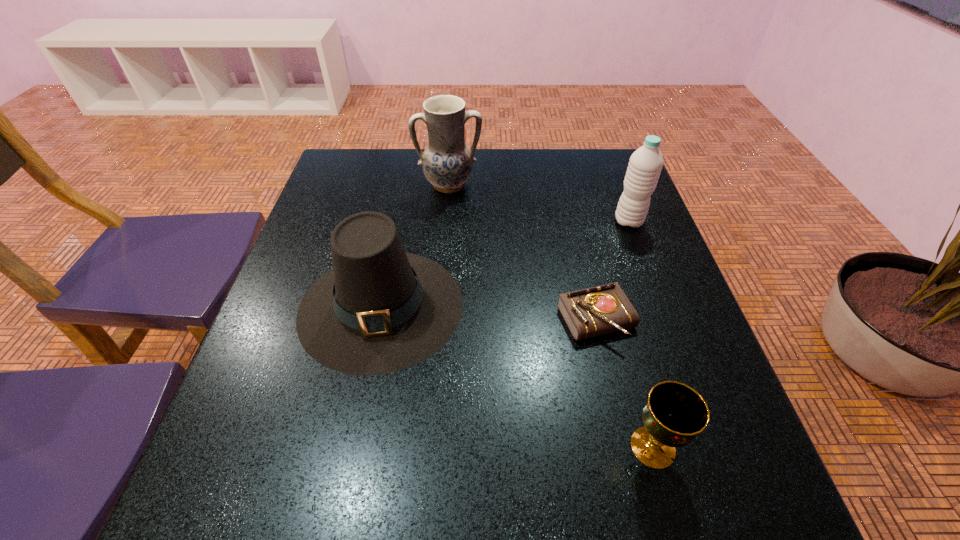
Where is `the farthest object`? This screenshot has width=960, height=540. the farthest object is located at coordinates (447, 162).

The image size is (960, 540). What are the coordinates of `the fourth nearest object` in the screenshot? It's located at tap(645, 165).

Find the location of a particular element. This screenshot has width=960, height=540. the rightmost object is located at coordinates (645, 165).

Identify the location of the third shortest object. (379, 310).

Where is `the fourth tallest object`? the fourth tallest object is located at coordinates (674, 414).

Locate an element on the screen. The image size is (960, 540). chalice is located at coordinates 674,414.

Find the location of a particular element. diary is located at coordinates (604, 309).

The height and width of the screenshot is (540, 960). I want to click on free space located 0.110m on the front of the pottery, so click(445, 225).

The height and width of the screenshot is (540, 960). What are the coordinates of `vacant region located 0.120m on the back of the rightmost object` in the screenshot? It's located at (615, 186).

This screenshot has height=540, width=960. What are the coordinates of `vacant space located 0.240m on the front-facing side of the hat` in the screenshot? It's located at coord(337,519).